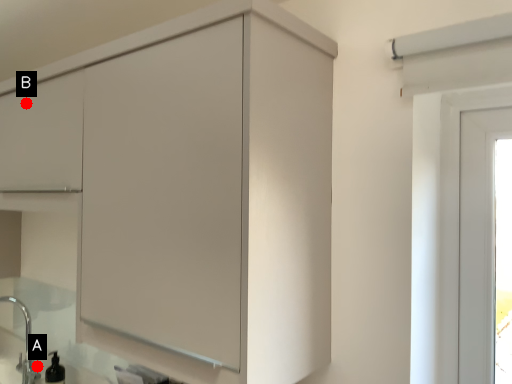
Question: Two points are circled on the image, labeled by A and B beside each circle. Which point is closer to the camera taking this photo?

Choices:
 (A) A is closer
 (B) B is closer

Answer: (B)